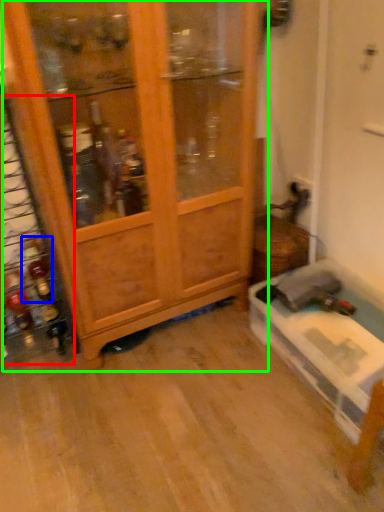
Question: Which object is positioned closest to shelf (highlighted by a red box)? Select from bottle (highlighted by a blue box) and cupboard (highlighted by a green box).

Choices:
 (A) bottle
 (B) cupboard

Answer: (A)